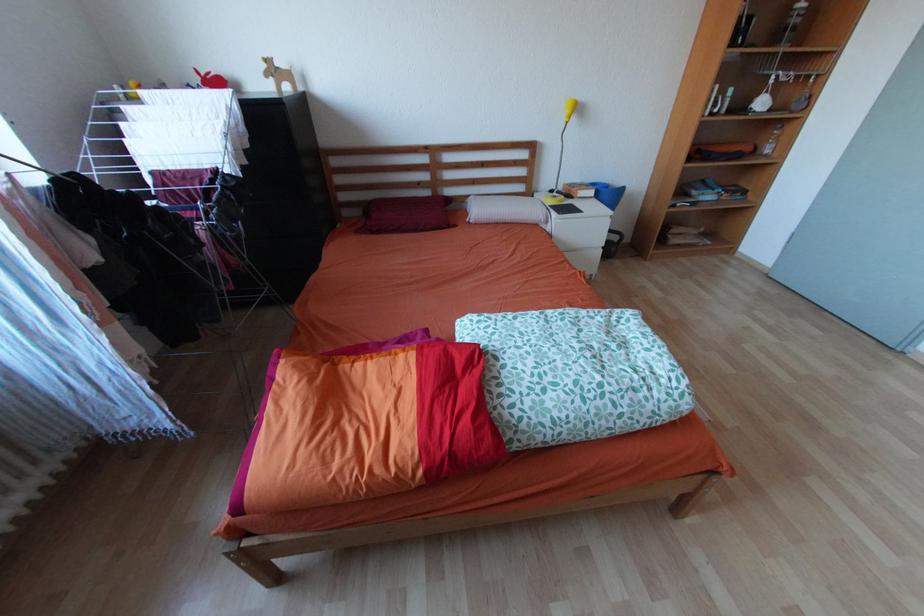
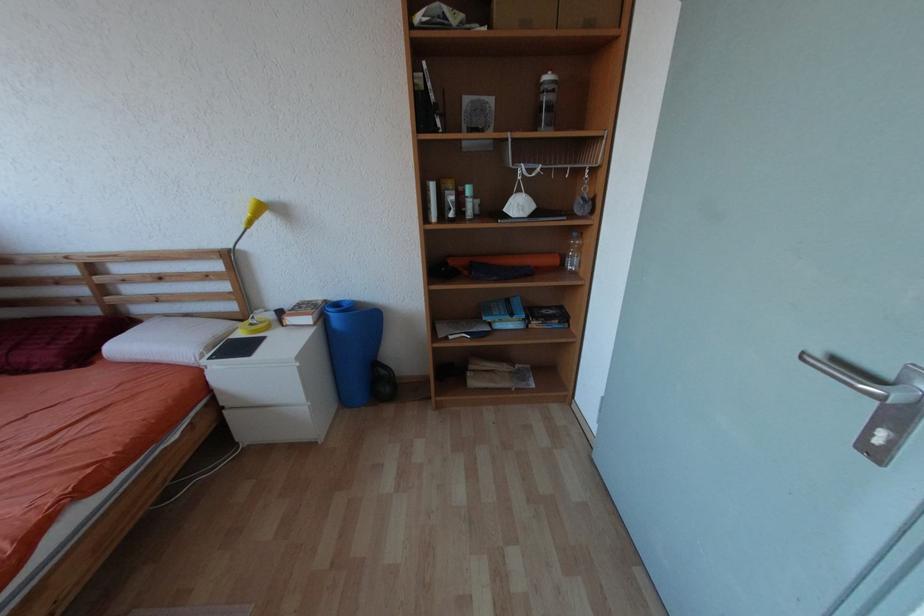
In a continuous first-person perspective shot, in which direction is the camera moving?

The cameraman walked toward right, forward.